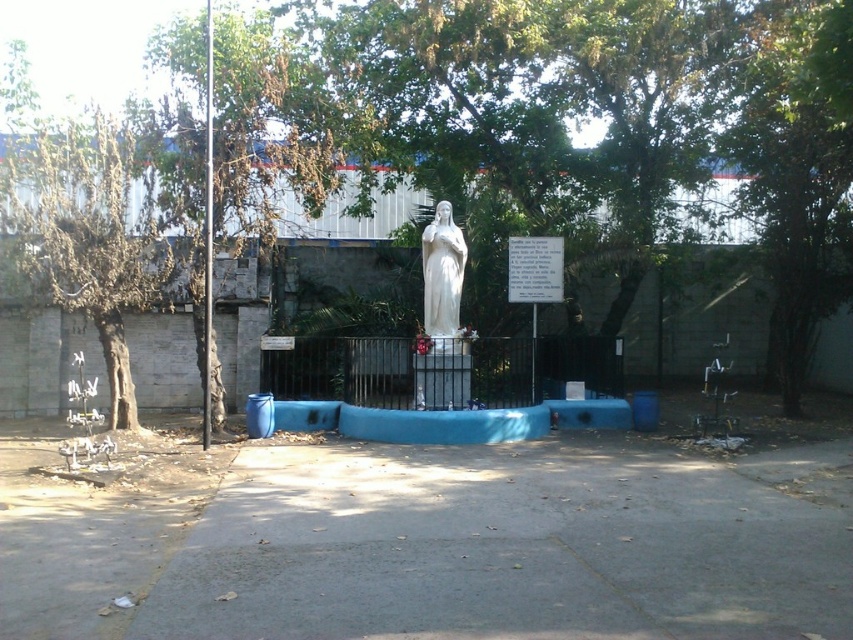
Question: Which is farther from the white marble statue at center?

Choices:
 (A) gray concrete pavement at center
 (B) green leafy tree at center

Answer: (A)

Question: In this image, where is gray concrete pavement at center located relative to green leafy tree at center?

Choices:
 (A) above
 (B) below

Answer: (B)

Question: Is gray concrete pavement at center positioned behind white marble statue at center?

Choices:
 (A) no
 (B) yes

Answer: (A)

Question: Which point is farther to the camera?

Choices:
 (A) green leafy tree at center
 (B) white marble statue at center
 (C) gray concrete pavement at center

Answer: (B)

Question: Is the position of gray concrete pavement at center more distant than that of green leafy tree at center?

Choices:
 (A) yes
 (B) no

Answer: (B)

Question: Which point appears farthest from the camera in this image?

Choices:
 (A) (437, 305)
 (B) (480, 218)
 (C) (788, 532)

Answer: (B)